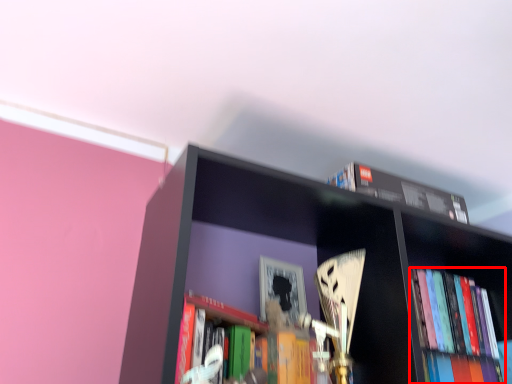
Question: Where is book (annotated by the red box) located in relation to book in the image?

Choices:
 (A) left
 (B) right

Answer: (B)